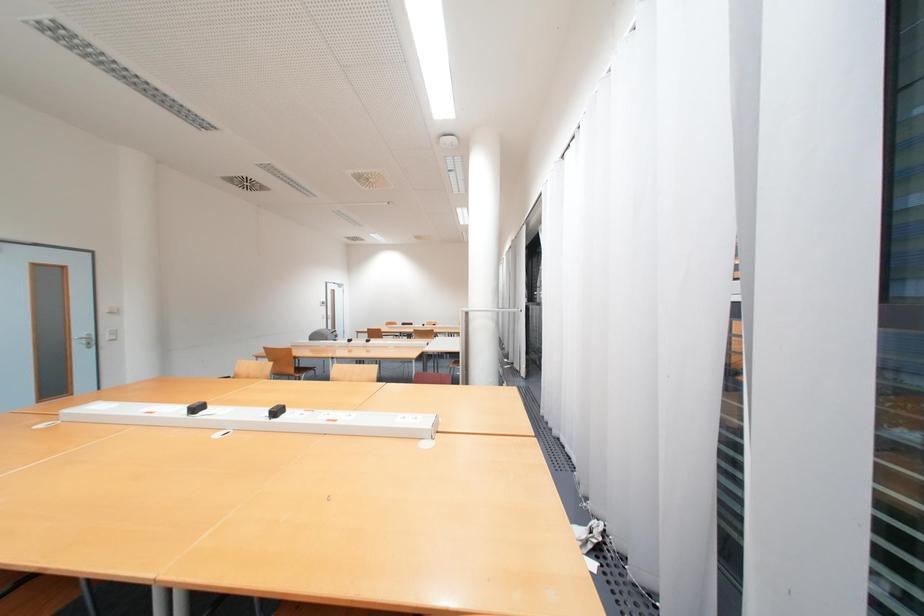
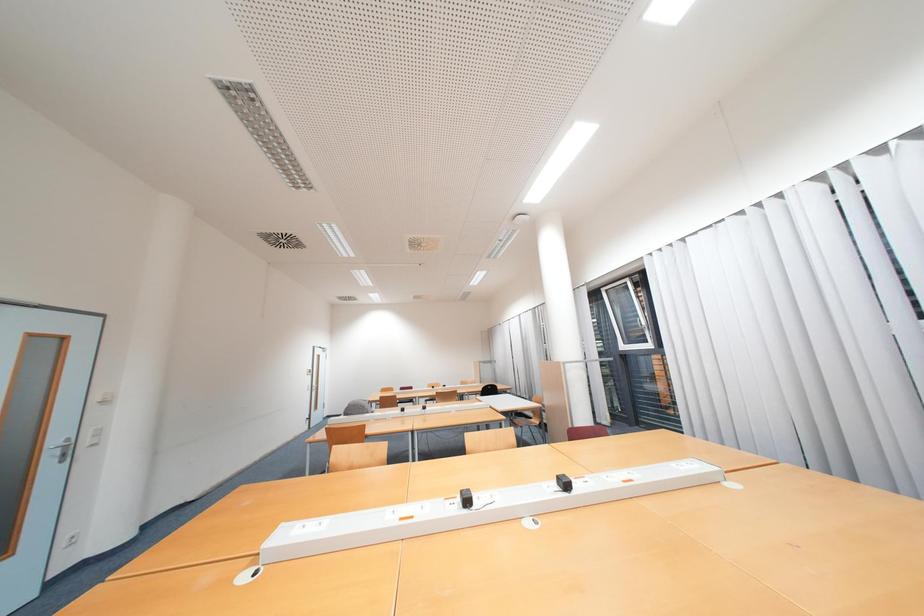
Question: The images are taken continuously from a first-person perspective. In which direction are you moving?

Choices:
 (A) Left
 (B) Right
 (C) Forward
 (D) Backward

Answer: (A)